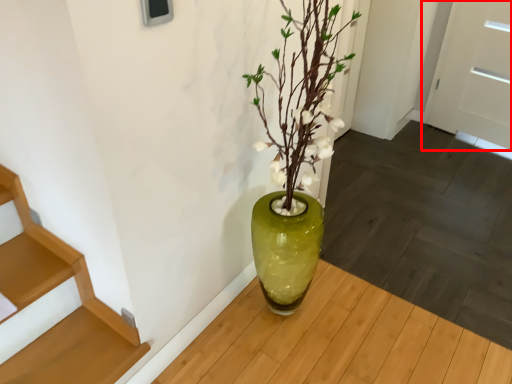
Question: In this image, where is door (annotated by the red box) located relative to stairs?

Choices:
 (A) right
 (B) left

Answer: (A)